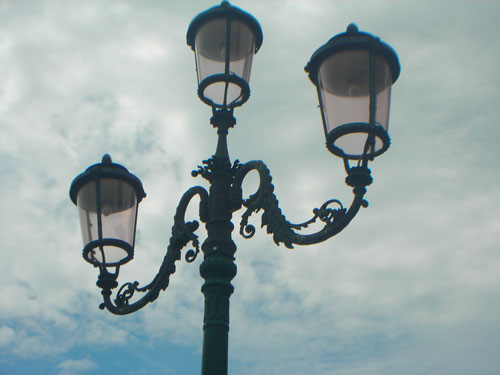
You are a GUI agent. You are given a task and a screenshot of the screen. Output one action in this format:
    pyautogui.click(x=<x>, y=<y>)
    Task: Click on the floral design on the left
    This screenshot has width=500, height=375.
    Given the screenshot: What is the action you would take?
    pyautogui.click(x=189, y=227), pyautogui.click(x=125, y=289)